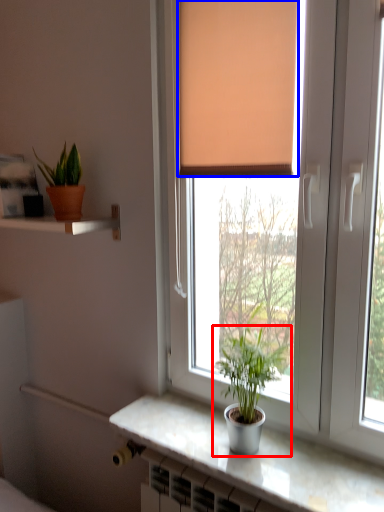
Question: Among these objects, which one is farthest to the camera, houseplant (highlighted by a red box) or curtain (highlighted by a blue box)?

Choices:
 (A) houseplant
 (B) curtain

Answer: (B)